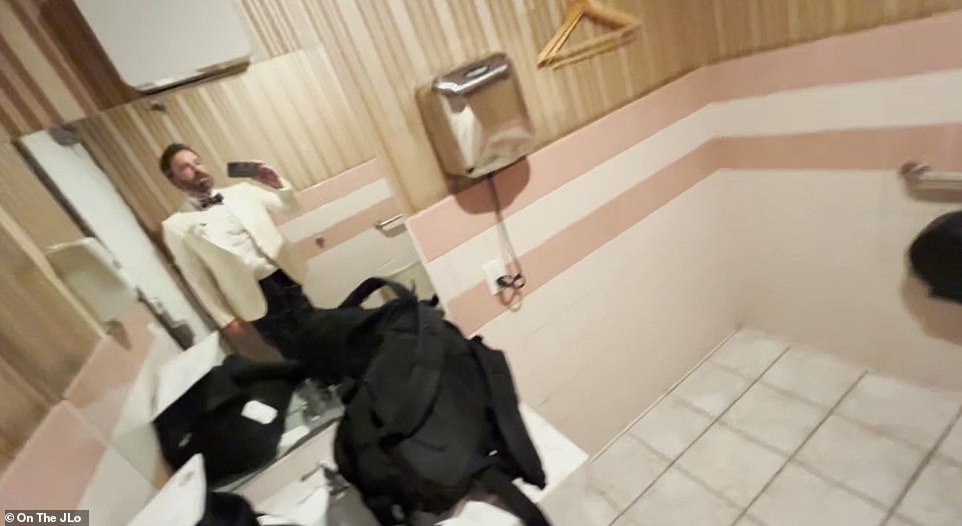
Where is `hanger`? The height and width of the screenshot is (526, 962). hanger is located at coordinates (586, 72).